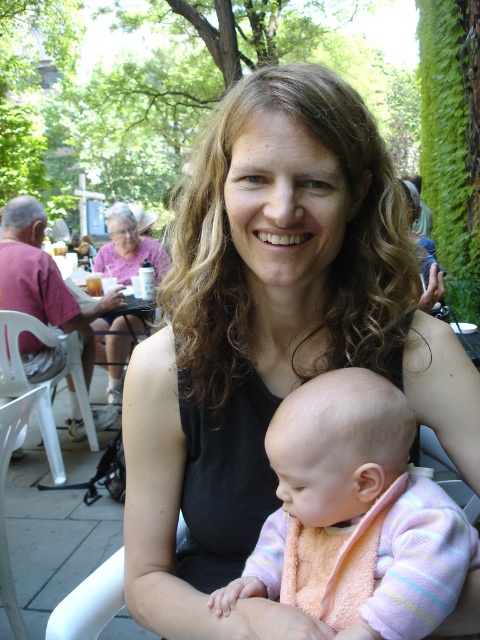
Question: Which is nearer to the black fabric tank top at center?

Choices:
 (A) pastel striped sweater at center
 (B) white plastic chair at lower left

Answer: (A)

Question: Does black fabric tank top at center appear over pastel striped sweater at center?

Choices:
 (A) yes
 (B) no

Answer: (A)

Question: Is black fabric tank top at center above pastel striped sweater at center?

Choices:
 (A) no
 (B) yes

Answer: (B)

Question: Which point is farther to the camera?

Choices:
 (A) white plastic chair at lower left
 (B) matte pink shirt at upper left
 (C) black fabric tank top at center

Answer: (B)

Question: Does pastel striped sweater at center appear under matte pink shirt at upper left?

Choices:
 (A) no
 (B) yes

Answer: (B)

Question: Estimate the real-world distances between objects in this image. Which object is farther from the matte pink shirt at upper left?

Choices:
 (A) white plastic chair at lower left
 (B) black fabric tank top at center

Answer: (B)